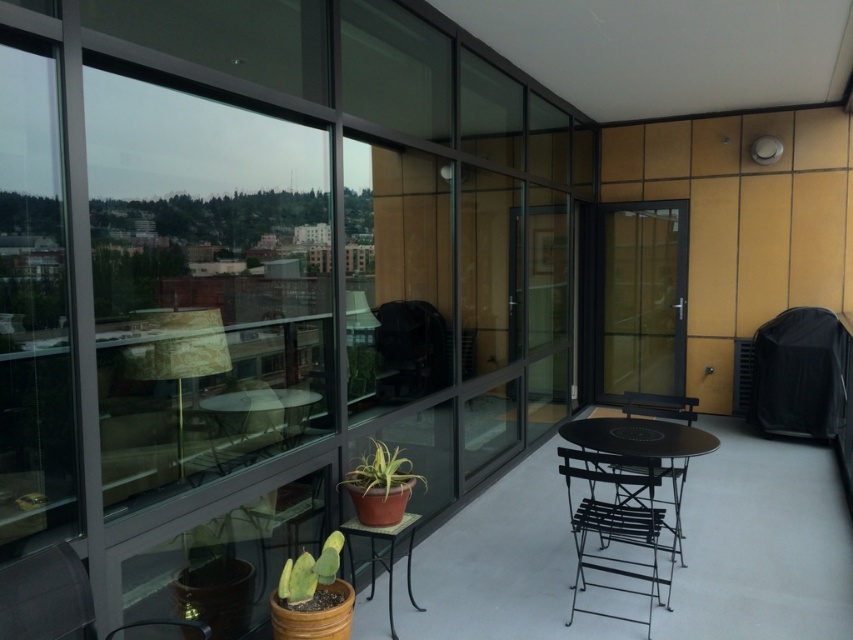
Measure the distance between transparent glass door at center-right and matte terracotta pot at center.

The distance of transparent glass door at center-right from matte terracotta pot at center is 14.78 feet.

From the picture: Between transparent glass door at center-right and matte terracotta pot at center, which one has less height?

matte terracotta pot at center is shorter.

Identify the location of transparent glass door at center-right. This screenshot has height=640, width=853. (643, 298).

Which is above, matte black table at center or green matte cactus at lower left?

Positioned higher is green matte cactus at lower left.

Which of these two, matte black table at center or green matte cactus at lower left, stands taller?

Standing taller between the two is matte black table at center.

This screenshot has height=640, width=853. Describe the element at coordinates (381, 556) in the screenshot. I see `matte black table at center` at that location.

Find the location of a particular element. matte black table at center is located at coordinates (381, 556).

In the scene shown: Can you confirm if black metal table at center is positioned to the left of matte terracotta pot at center?

Incorrect, black metal table at center is not on the left side of matte terracotta pot at center.

Does black metal table at center appear over matte terracotta pot at center?

Correct, black metal table at center is located above matte terracotta pot at center.

Identify the location of black metal table at center. (637, 436).